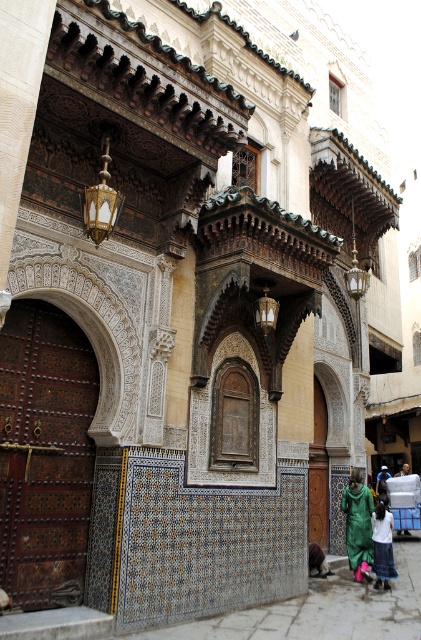
Does green fabric at lower center lie behind green fabric person at lower right?

No, it is in front of green fabric person at lower right.

Is green fabric at lower center smaller than green fabric person at lower right?

Actually, green fabric at lower center might be larger than green fabric person at lower right.

What do you see at coordinates (357, 525) in the screenshot?
I see `green fabric at lower center` at bounding box center [357, 525].

This screenshot has width=421, height=640. Identify the location of green fabric at lower center. (357, 525).

Is green fabric at lower center taller than dark green fabric at lower center?

Indeed, green fabric at lower center has a greater height compared to dark green fabric at lower center.

Is green fabric at lower center below dark green fabric at lower center?

No.

Identify the location of green fabric at lower center. This screenshot has height=640, width=421. (357, 525).

Find the location of `green fabric at lower center`. green fabric at lower center is located at coordinates (357, 525).

Who is positioned more to the left, white cotton shirt at lower center or dark green fabric at lower center?

white cotton shirt at lower center is more to the left.

Can you confirm if white cotton shirt at lower center is bigger than dark green fabric at lower center?

No.

Locate an element on the screen. The height and width of the screenshot is (640, 421). white cotton shirt at lower center is located at coordinates (383, 545).

Where is `white cotton shirt at lower center`? Image resolution: width=421 pixels, height=640 pixels. white cotton shirt at lower center is located at coordinates (383, 545).